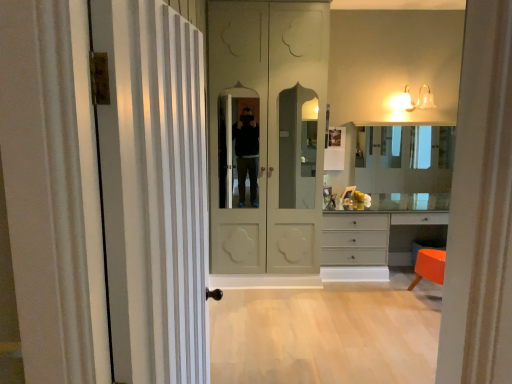
Where is `vacant area on top of light wood floor at lower center (from a real-world perspective)`? The width and height of the screenshot is (512, 384). vacant area on top of light wood floor at lower center (from a real-world perspective) is located at coordinates (327, 316).